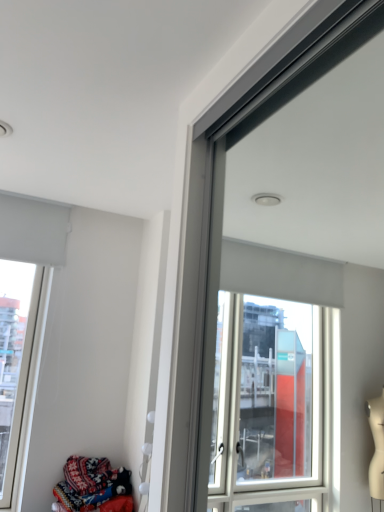
Question: Considering the relative positions of white matte window at upper left and patterned fabric at lower left in the image provided, is white matte window at upper left to the left or to the right of patterned fabric at lower left?

Choices:
 (A) left
 (B) right

Answer: (A)

Question: From the image's perspective, is white matte window at upper left above or below patterned fabric at lower left?

Choices:
 (A) below
 (B) above

Answer: (B)

Question: Is white matte window at upper left in front of or behind patterned fabric at lower left in the image?

Choices:
 (A) front
 (B) behind

Answer: (B)

Question: Looking at the image, does patterned fabric at lower left seem bigger or smaller compared to white matte window at upper left?

Choices:
 (A) big
 (B) small

Answer: (B)

Question: From a real-world perspective, is patterned fabric at lower left above or below white matte window at upper left?

Choices:
 (A) above
 (B) below

Answer: (B)

Question: In the image, is patterned fabric at lower left positioned in front of or behind white matte window at upper left?

Choices:
 (A) front
 (B) behind

Answer: (A)

Question: From the image's perspective, is patterned fabric at lower left above or below white matte window at upper left?

Choices:
 (A) above
 (B) below

Answer: (B)